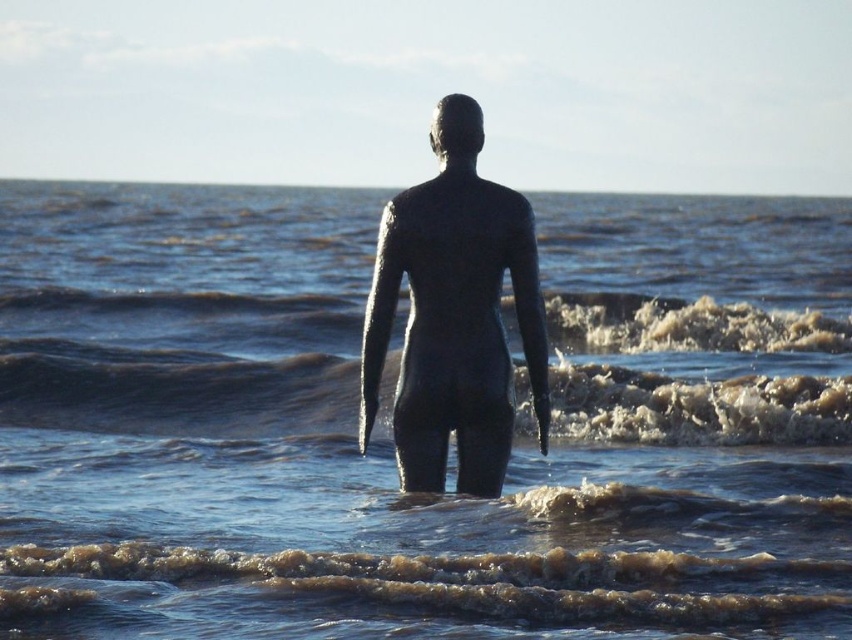
Question: Does brown textured water at center appear over bronze statue at center?

Choices:
 (A) yes
 (B) no

Answer: (B)

Question: Can you confirm if brown textured water at center is positioned below bronze statue at center?

Choices:
 (A) yes
 (B) no

Answer: (A)

Question: Which object appears closest to the camera in this image?

Choices:
 (A) brown textured water at center
 (B) shiny metallic water at center
 (C) bronze statue at center

Answer: (B)

Question: Which point is closer to the camera?

Choices:
 (A) (807, 557)
 (B) (417, 264)

Answer: (A)

Question: Which point appears farthest from the camera in this image?

Choices:
 (A) (73, 451)
 (B) (400, 483)

Answer: (A)

Question: Is brown textured water at center positioned at the back of bronze statue at center?

Choices:
 (A) no
 (B) yes

Answer: (B)